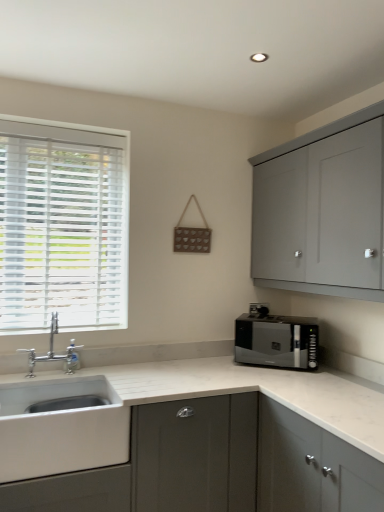
Question: Considering their positions, is shiny black microwave at right located in front of or behind matte gray cabinet at upper right, the second cabinetry positioned from the left?

Choices:
 (A) front
 (B) behind

Answer: (B)

Question: Does point (292, 345) appear closer or farther from the camera than point (334, 264)?

Choices:
 (A) farther
 (B) closer

Answer: (A)

Question: Which object is the farthest from the matte gray cabinet at upper right, the second cabinetry positioned from the left?

Choices:
 (A) matte gray cabinet at lower left, which appears as the first cabinetry when ordered from the bottom
 (B) silver metallic faucet at left
 (C) shiny black microwave at right
 (D) white wood blinds at left
 (E) white ceramic sink at lower left

Answer: (B)

Question: Which is farther from the silver metallic faucet at left?

Choices:
 (A) matte gray cabinet at upper right, the second cabinetry positioned from the left
 (B) matte gray cabinet at lower left, which appears as the first cabinetry when ordered from the bottom
 (C) shiny black microwave at right
 (D) white ceramic sink at lower left
 (E) white wood blinds at left

Answer: (A)